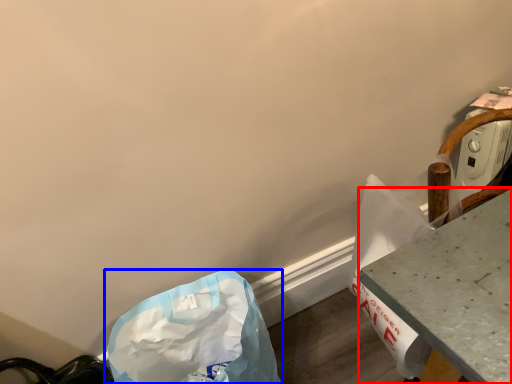
Question: Which point is closer to the camera, table (highlighted by a red box) or plastic bag (highlighted by a blue box)?

Choices:
 (A) table
 (B) plastic bag

Answer: (A)